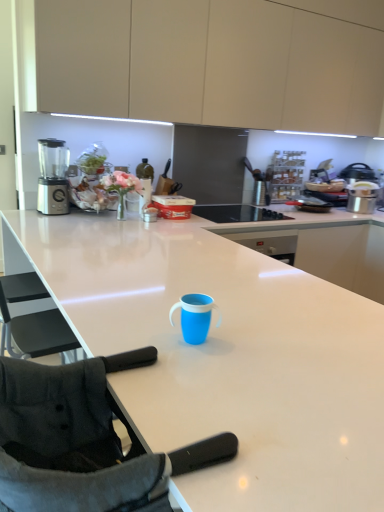
Question: Considering the relative positions of black fabric folding chair at lower left and blue plastic sippy cup at center in the image provided, is black fabric folding chair at lower left to the left or to the right of blue plastic sippy cup at center?

Choices:
 (A) left
 (B) right

Answer: (A)

Question: Considering the positions of black fabric folding chair at lower left and blue plastic sippy cup at center in the image, is black fabric folding chair at lower left wider or thinner than blue plastic sippy cup at center?

Choices:
 (A) thin
 (B) wide

Answer: (B)

Question: Estimate the real-world distances between objects in this image. Which object is closer to the black fabric folding chair at lower left?

Choices:
 (A) matte beige cabinets at upper center
 (B) white glossy countertop at center
 (C) black glass cooktop at center
 (D) satin silver blender at left
 (E) blue plastic sippy cup at center

Answer: (E)

Question: Based on their relative distances, which object is farther from the black fabric folding chair at lower left?

Choices:
 (A) satin silver blender at left
 (B) white glossy countertop at center
 (C) black glass cooktop at center
 (D) blue plastic sippy cup at center
 (E) matte beige cabinets at upper center

Answer: (E)